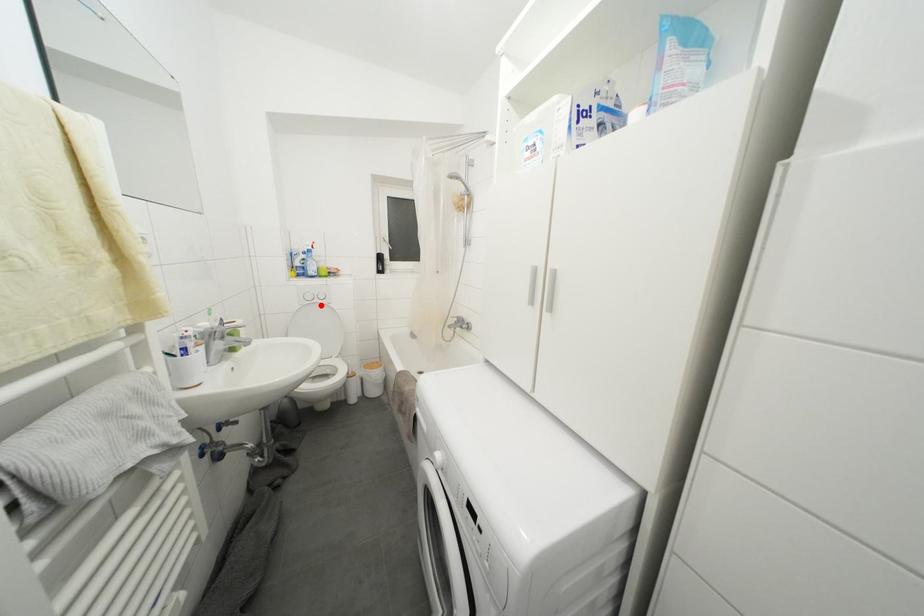
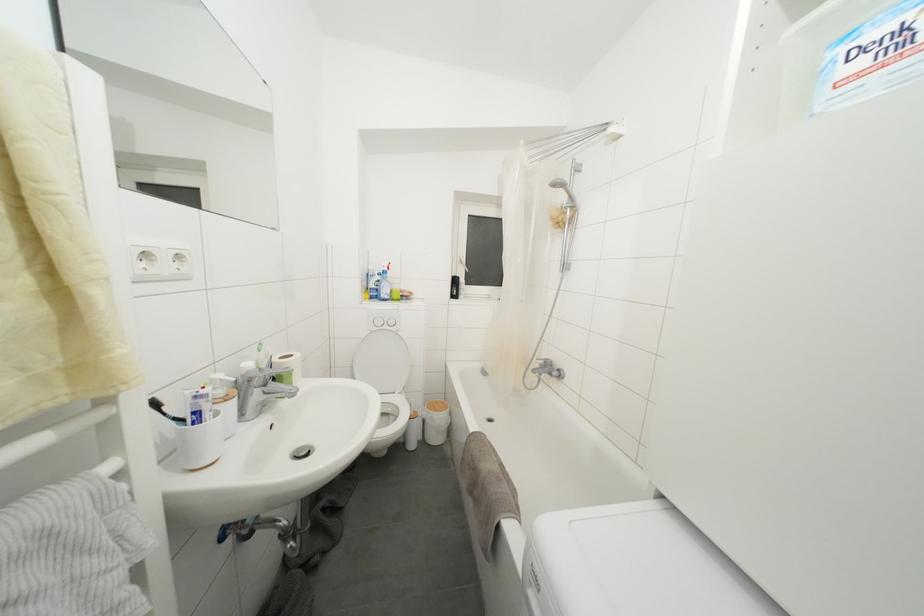
Locate, in the second image, the point that corresponds to the highlighted location in the first image.

(390, 331)